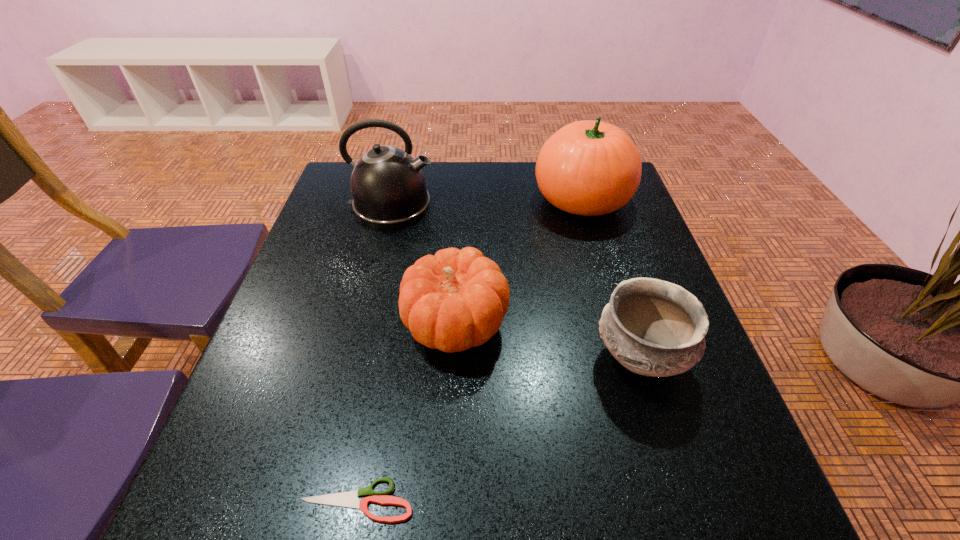
Where is `object at the far left corner`? The width and height of the screenshot is (960, 540). object at the far left corner is located at coordinates (388, 187).

The width and height of the screenshot is (960, 540). Find the location of `object that is at the near left corner`. object that is at the near left corner is located at coordinates (350, 499).

At what (x,y) coordinates should I click in order to perform the action: click on object that is at the far right corner. Please return your answer as a coordinate pair (x, y). Looking at the image, I should click on (590, 168).

The image size is (960, 540). Find the location of `blank space at the far edge of the desktop`. blank space at the far edge of the desktop is located at coordinates (x=453, y=164).

Where is `free point at the near edge`? This screenshot has height=540, width=960. free point at the near edge is located at coordinates (395, 525).

In the image, there is a desktop. Where is `vacant space at the left edge`? vacant space at the left edge is located at coordinates (341, 288).

In order to click on free spot at the near left corner of the desktop in this screenshot , I will do `click(249, 478)`.

Image resolution: width=960 pixels, height=540 pixels. In the image, there is a desktop. In order to click on free space at the near right corner in this screenshot , I will do point(727,519).

Where is `free space that is in between the pottery and the kettle`? Image resolution: width=960 pixels, height=540 pixels. free space that is in between the pottery and the kettle is located at coordinates (516, 282).

You are a GUI agent. You are given a task and a screenshot of the screen. Output one action in this format:
    pyautogui.click(x=<x>, y=<y>)
    Task: Click on the vacant area that lies between the right pumpkin and the scissors
    
    Given the screenshot: What is the action you would take?
    coord(469,349)